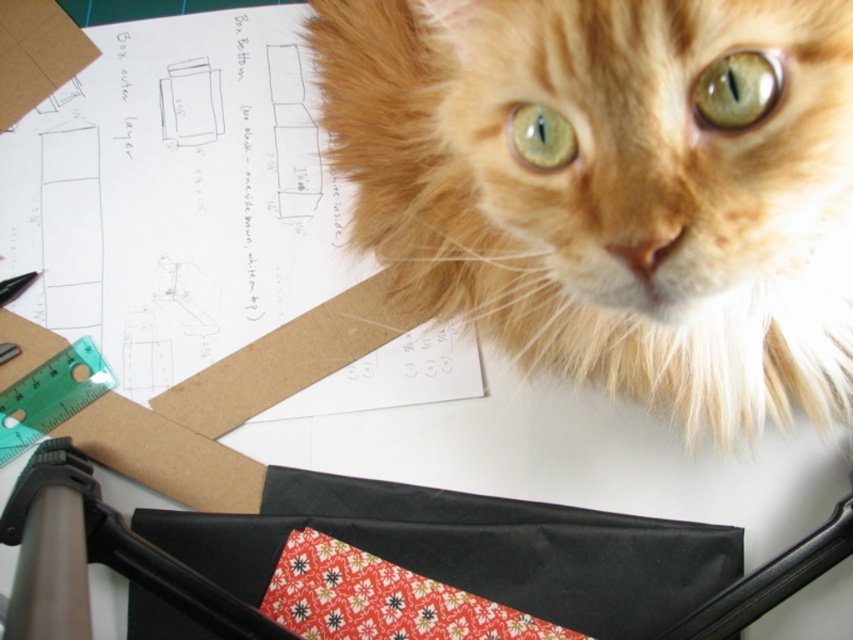
Question: Does orange fur cat at upper center have a lesser width compared to brown cardboard paper at upper left?

Choices:
 (A) yes
 (B) no

Answer: (A)

Question: Which point is farther to the camera?

Choices:
 (A) orange fur cat at upper center
 (B) brown cardboard paper at upper left

Answer: (B)

Question: Can you confirm if orange fur cat at upper center is positioned to the right of brown cardboard paper at upper left?

Choices:
 (A) no
 (B) yes

Answer: (B)

Question: Which point appears closest to the camera in this image?

Choices:
 (A) (770, 163)
 (B) (93, 106)

Answer: (A)

Question: Can you confirm if orange fur cat at upper center is wider than brown cardboard paper at upper left?

Choices:
 (A) no
 (B) yes

Answer: (A)

Question: Which point is farther from the camera taking this photo?

Choices:
 (A) (54, 268)
 (B) (782, 44)

Answer: (A)